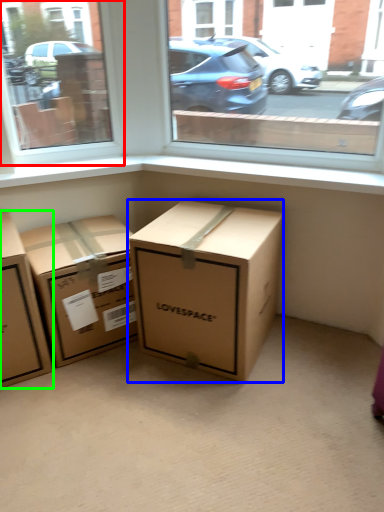
Question: Based on their relative distances, which object is nearer to window (highlighted by a red box)? Choose from box (highlighted by a blue box) and box (highlighted by a green box).

Choices:
 (A) box
 (B) box

Answer: (B)